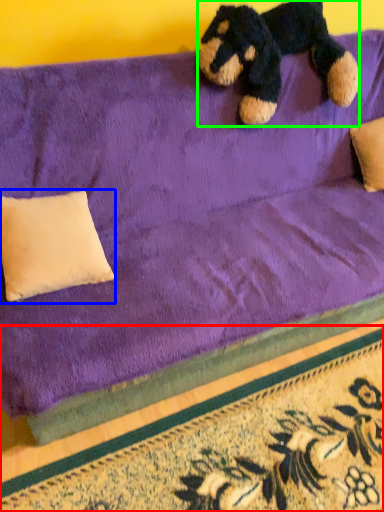
Question: Considering the real-world distances, which object is farthest from doormat (highlighted by a red box)? pillow (highlighted by a blue box) or teddy bear (highlighted by a green box)?

Choices:
 (A) pillow
 (B) teddy bear

Answer: (B)